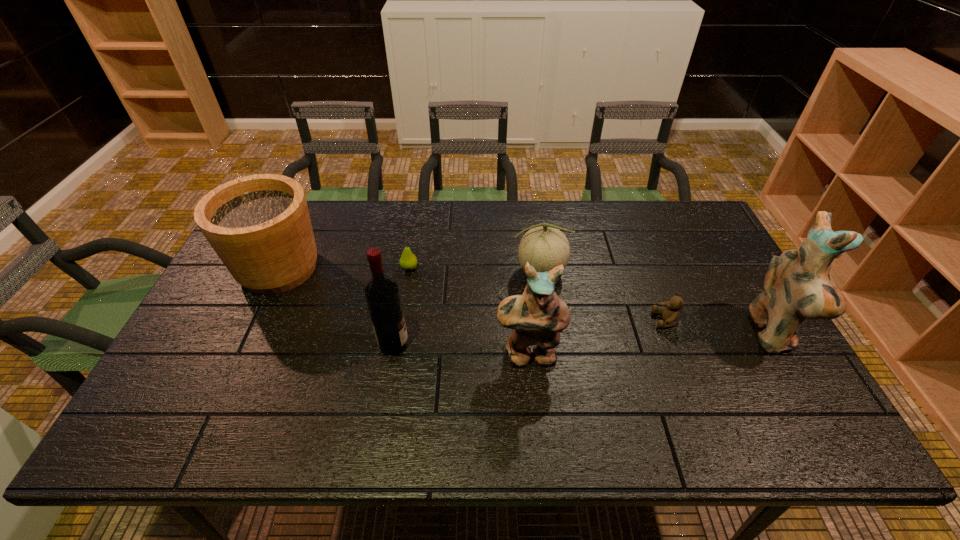
Locate an element on the screen. The height and width of the screenshot is (540, 960). the shorter figurine is located at coordinates (536, 317).

Locate an element on the screen. This screenshot has width=960, height=540. the rightmost object is located at coordinates (797, 286).

What are the coordinates of `the right figurine` in the screenshot? It's located at (797, 286).

Image resolution: width=960 pixels, height=540 pixels. I want to click on pear, so click(408, 261).

At what (x,y) coordinates should I click in order to perform the action: click on cantaloup. Please return your answer as a coordinate pair (x, y). Looking at the image, I should click on (544, 246).

Locate an element on the screen. The width and height of the screenshot is (960, 540). flowerpot is located at coordinates (259, 225).

Image resolution: width=960 pixels, height=540 pixels. Find the location of `the leftmost object`. the leftmost object is located at coordinates (259, 225).

The height and width of the screenshot is (540, 960). Find the location of `alcohol`. alcohol is located at coordinates (382, 294).

You are a GUI agent. You are given a task and a screenshot of the screen. Output one action in this format:
    pyautogui.click(x=<x>, y=<y>)
    Task: Click on the second object from right to left
    This screenshot has height=540, width=960.
    Given the screenshot: What is the action you would take?
    pyautogui.click(x=670, y=315)

Locate an element on the screen. This screenshot has height=540, width=960. free region located 0.060m on the front-facing side of the shorter figurine is located at coordinates (532, 393).